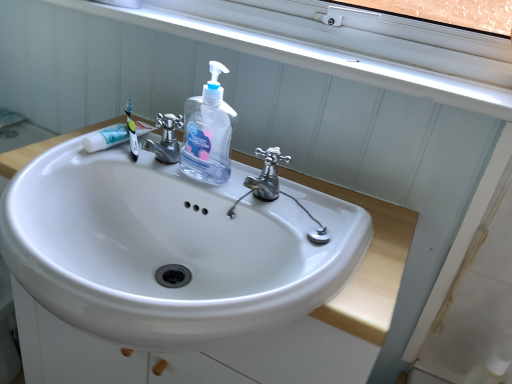
The height and width of the screenshot is (384, 512). What do you see at coordinates (106, 138) in the screenshot?
I see `white glossy tube at upper left` at bounding box center [106, 138].

Describe the element at coordinates (208, 132) in the screenshot. I see `transparent plastic hand soap at center` at that location.

What is the approximate width of silver metallic faucet at center, which is the 2th tap in right-to-left order?

silver metallic faucet at center, which is the 2th tap in right-to-left order, is 4.35 inches wide.

Consider the image. Measure the distance between black plastic toothbrush at upper left and camera.

black plastic toothbrush at upper left and camera are 30.41 inches apart from each other.

The image size is (512, 384). Describe the element at coordinates (342, 46) in the screenshot. I see `white plastic window sill at upper center` at that location.

Where is `white plastic window sill at upper center`? white plastic window sill at upper center is located at coordinates (342, 46).

Locate an element on the screen. The width and height of the screenshot is (512, 384). white glossy tube at upper left is located at coordinates (106, 138).

Is white plastic window sill at upper center not within black plastic toothbrush at upper left?

Absolutely, white plastic window sill at upper center is external to black plastic toothbrush at upper left.

Between white plastic window sill at upper center and black plastic toothbrush at upper left, which one has more height?

Standing taller between the two is black plastic toothbrush at upper left.

Considering the relative positions of white plastic window sill at upper center and black plastic toothbrush at upper left in the image provided, is white plastic window sill at upper center behind black plastic toothbrush at upper left?

No, it is not.

Is white plastic window sill at upper center oriented towards black plastic toothbrush at upper left?

No.

Can you confirm if white plastic window sill at upper center is wider than polished chrome tap at center, placed as the second tap when sorted from left to right?

Correct, the width of white plastic window sill at upper center exceeds that of polished chrome tap at center, placed as the second tap when sorted from left to right.

Does white plastic window sill at upper center have a greater height compared to polished chrome tap at center, arranged as the 1th tap when viewed from the right?

In fact, white plastic window sill at upper center may be shorter than polished chrome tap at center, arranged as the 1th tap when viewed from the right.

Is white plastic window sill at upper center at the left side of polished chrome tap at center, placed as the second tap when sorted from left to right?

Indeed, white plastic window sill at upper center is positioned on the left side of polished chrome tap at center, placed as the second tap when sorted from left to right.

Between white plastic window sill at upper center and polished chrome tap at center, arranged as the 1th tap when viewed from the right, which one has larger size?

white plastic window sill at upper center.

Are black plastic toothbrush at upper left and white plastic window sill at upper center making contact?

There is a gap between black plastic toothbrush at upper left and white plastic window sill at upper center.

You are a GUI agent. You are given a task and a screenshot of the screen. Output one action in this format:
    pyautogui.click(x=<x>, y=<y>)
    Task: Click on the toothbrush located behind the white plastic window sill at upper center
    This screenshot has height=384, width=512.
    Given the screenshot: What is the action you would take?
    pyautogui.click(x=131, y=131)

Considering the relative sizes of black plastic toothbrush at upper left and white plastic window sill at upper center in the image provided, is black plastic toothbrush at upper left thinner than white plastic window sill at upper center?

Correct, the width of black plastic toothbrush at upper left is less than that of white plastic window sill at upper center.

Does black plastic toothbrush at upper left lie in front of white plastic window sill at upper center?

No.

Considering the sizes of white glossy tube at upper left and white plastic window sill at upper center in the image, is white glossy tube at upper left taller or shorter than white plastic window sill at upper center?

white glossy tube at upper left is taller than white plastic window sill at upper center.

Considering the relative sizes of white glossy tube at upper left and white plastic window sill at upper center in the image provided, is white glossy tube at upper left smaller than white plastic window sill at upper center?

Correct, white glossy tube at upper left occupies less space than white plastic window sill at upper center.

Considering the relative sizes of white glossy tube at upper left and white plastic window sill at upper center in the image provided, is white glossy tube at upper left thinner than white plastic window sill at upper center?

Yes, white glossy tube at upper left is thinner than white plastic window sill at upper center.

Who is smaller, polished chrome tap at center, arranged as the 1th tap when viewed from the right, or white glossy sink at center?

polished chrome tap at center, arranged as the 1th tap when viewed from the right, is smaller.

Which is further, (278, 192) or (341, 209)?

Positioned behind is point (278, 192).

Is polished chrome tap at center, arranged as the 1th tap when viewed from the right, outside of white glossy sink at center?

Yes, polished chrome tap at center, arranged as the 1th tap when viewed from the right, is not within white glossy sink at center.

From a real-world perspective, is polished chrome tap at center, arranged as the 1th tap when viewed from the right, physically located above or below white glossy sink at center?

polished chrome tap at center, arranged as the 1th tap when viewed from the right, is situated higher than white glossy sink at center in the real world.

Is point (97, 147) farther from viewer compared to point (169, 123)?

Yes, point (97, 147) is farther from viewer.

From a real-world perspective, is white glossy tube at upper left positioned over silver metallic faucet at center, which is the 2th tap in right-to-left order, based on gravity?

No, from a real-world perspective, white glossy tube at upper left is not above silver metallic faucet at center, which is the 2th tap in right-to-left order.

From the picture: Is white glossy tube at upper left placed right next to silver metallic faucet at center, which is the 2th tap in right-to-left order?

Yes, white glossy tube at upper left and silver metallic faucet at center, which is the 2th tap in right-to-left order, clearly make contact.

Considering the relative positions of white glossy tube at upper left and silver metallic faucet at center, which is the 2th tap in right-to-left order, in the image provided, is white glossy tube at upper left in front of silver metallic faucet at center, which is the 2th tap in right-to-left order,?

No.

Is white plastic window sill at upper center situated inside white glossy tube at upper left or outside?

white plastic window sill at upper center is not enclosed by white glossy tube at upper left.

Is white plastic window sill at upper center facing away from white glossy tube at upper left?

white plastic window sill at upper center does not have its back to white glossy tube at upper left.

From a real-world perspective, which object stands above the other?

white plastic window sill at upper center, from a real-world perspective.

You are a GUI agent. You are given a task and a screenshot of the screen. Output one action in this format:
    pyautogui.click(x=<x>, y=<y>)
    Task: Click on the toothbrush that is behind the white plastic window sill at upper center
    The image size is (512, 384).
    Given the screenshot: What is the action you would take?
    pyautogui.click(x=131, y=131)

Locate an element on the screen. This screenshot has height=384, width=512. tap that is the 2nd one when counting downward from the white plastic window sill at upper center (from the image's perspective) is located at coordinates (267, 175).

Estimate the real-world distances between objects in this image. Which object is closer to transparent plastic hand soap at center, white glossy sink at center or black plastic toothbrush at upper left?

Based on the image, black plastic toothbrush at upper left appears to be nearer to transparent plastic hand soap at center.

Which object lies nearer to the anchor point white glossy tube at upper left, white glossy sink at center or transparent plastic hand soap at center?

transparent plastic hand soap at center is positioned closer to the anchor white glossy tube at upper left.

When comparing their distances from polished chrome tap at center, arranged as the 1th tap when viewed from the right, does white glossy tube at upper left or silver metallic faucet at center, positioned as the first tap in left-to-right order, seem closer?

The object closer to polished chrome tap at center, arranged as the 1th tap when viewed from the right, is silver metallic faucet at center, positioned as the first tap in left-to-right order.

Considering their positions, is polished chrome tap at center, arranged as the 1th tap when viewed from the right, positioned further to white glossy tube at upper left than transparent plastic hand soap at center?

polished chrome tap at center, arranged as the 1th tap when viewed from the right, lies further to white glossy tube at upper left than the other object.

Estimate the real-world distances between objects in this image. Which object is further from white glossy tube at upper left, transparent plastic hand soap at center or black plastic toothbrush at upper left?

transparent plastic hand soap at center.

Which object lies nearer to the anchor point white glossy sink at center, white plastic window sill at upper center or white glossy tube at upper left?

white glossy tube at upper left.

From the picture: From the image, which object appears to be nearer to black plastic toothbrush at upper left, transparent plastic hand soap at center or white glossy tube at upper left?

Among the two, white glossy tube at upper left is located nearer to black plastic toothbrush at upper left.

Looking at this image, estimate the real-world distances between objects in this image. Which object is closer to white glossy sink at center, silver metallic faucet at center, which is the 2th tap in right-to-left order, or polished chrome tap at center, placed as the second tap when sorted from left to right?

polished chrome tap at center, placed as the second tap when sorted from left to right, lies closer to white glossy sink at center than the other object.

In order to click on cleaning product between silver metallic faucet at center, positioned as the first tap in left-to-right order, and polished chrome tap at center, placed as the second tap when sorted from left to right, from left to right in this screenshot , I will do `click(208, 132)`.

At what (x,y) coordinates should I click in order to perform the action: click on tap between black plastic toothbrush at upper left and transparent plastic hand soap at center in the horizontal direction. Please return your answer as a coordinate pair (x, y). The height and width of the screenshot is (384, 512). Looking at the image, I should click on (166, 139).

The width and height of the screenshot is (512, 384). I want to click on tap between white glossy sink at center and silver metallic faucet at center, which is the 2th tap in right-to-left order, from front to back, so click(x=267, y=175).

Find the location of a particular element. The height and width of the screenshot is (384, 512). toothbrush between white plastic window sill at upper center and white glossy sink at center vertically is located at coordinates (131, 131).